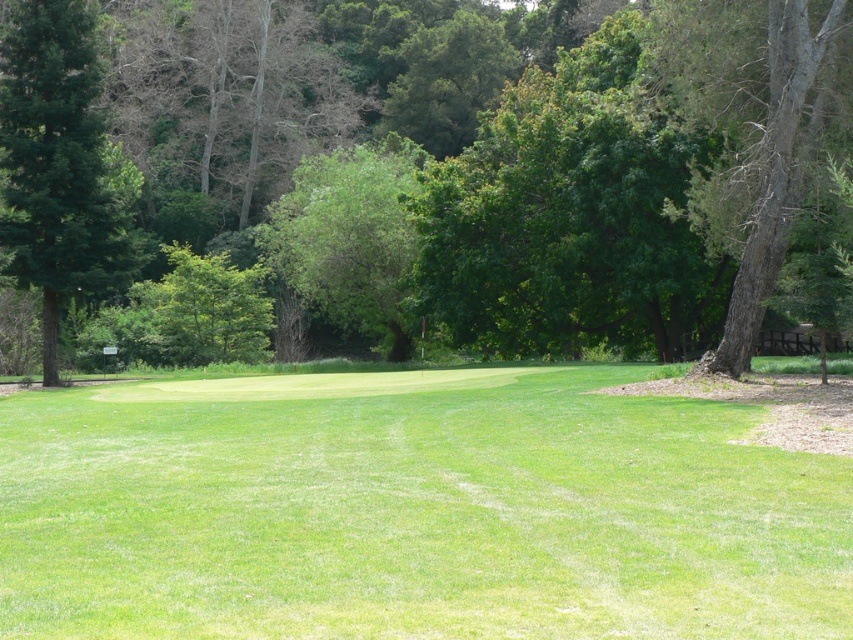
You are a golfer standing on the fairway and want to hit your ball towards the putting green. Which tree, the green leafy tree at center or the smooth gray bark tree at right, is larger and might block your shot if you aim directly towards the flag?

The green leafy tree at center is bigger than the smooth gray bark tree at right, so it might block your shot if you aim directly towards the flag.

You are a golfer standing on the fairway and want to hit a ball over both trees. Which tree, the green leafy tree at center or the smooth gray bark tree at right, do you need to aim higher to clear?

The green leafy tree at center is taller than the smooth gray bark tree at right, so you need to aim higher to clear the green leafy tree at center.

You are a golfer standing on the green smooth grass at center. You want to hit a ball to the green matte tree at left. Can you reach it with a 50 yard shot?

The distance between the green smooth grass at center and the green matte tree at left is 51.22 feet, which is approximately 17 yards. A 50 yard shot would easily cover this distance.